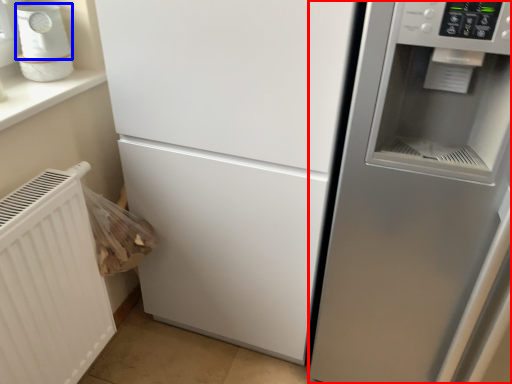
Question: Which of the following is the farthest to the observer, fridge (highlighted by a red box) or appliance (highlighted by a blue box)?

Choices:
 (A) fridge
 (B) appliance

Answer: (B)